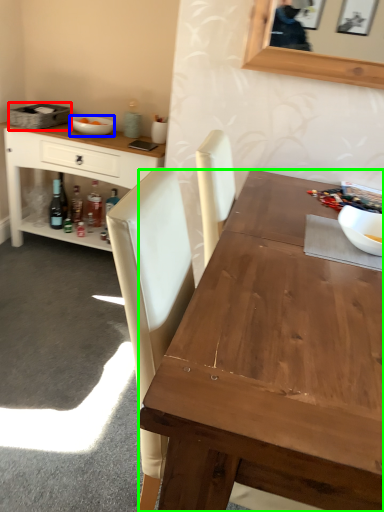
Question: Which object is positioned closest to picnic basket (highlighted by a red box)? Select from bowl (highlighted by a blue box) and desk (highlighted by a green box).

Choices:
 (A) bowl
 (B) desk

Answer: (A)